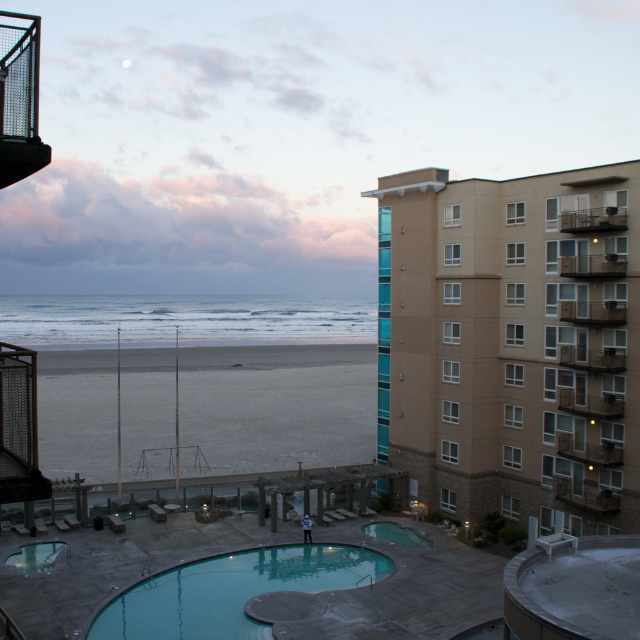
You are a lifeguard standing at the edge of the gray sand at lower left and need to reach the clear glass pool at lower left quickly. Considering you can run at a speed of 5 meters per second, how many seconds will it take you to reach the pool?

The distance between the gray sand at lower left and the clear glass pool at lower left is 50.25 meters. At a running speed of 5 meters per second, dividing the distance by the speed gives 50.25 divided by 5 equals 10.05 seconds. Therefore, it will take approximately 10.05 seconds to reach the pool.